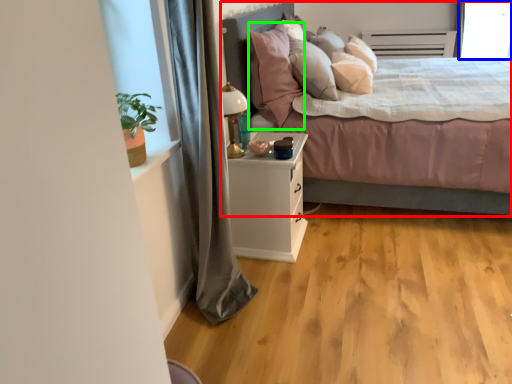
Question: Based on their relative distances, which object is farther from bed (highlighted by a red box)? Choose from window screen (highlighted by a blue box) and pillow (highlighted by a green box).

Choices:
 (A) window screen
 (B) pillow

Answer: (A)